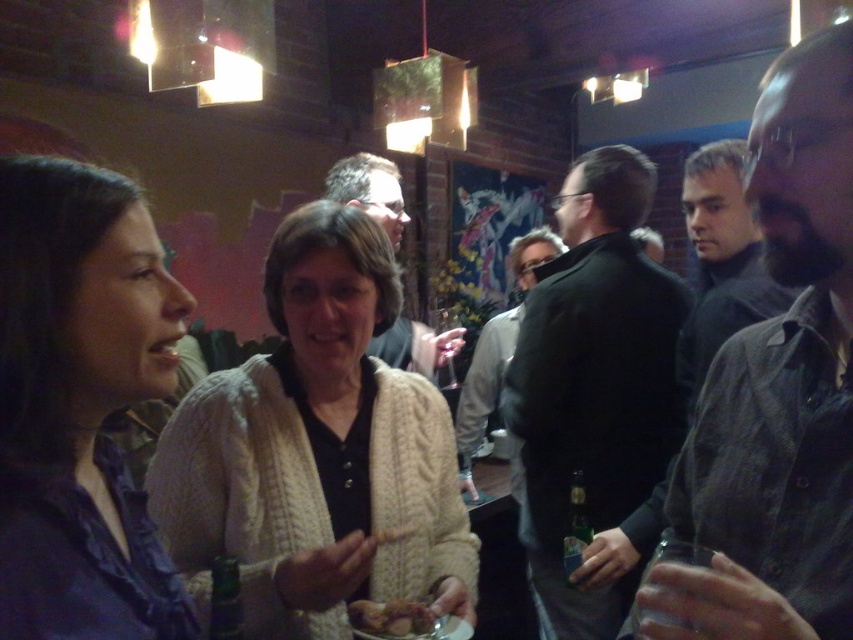
You are a photographer at the event and want to capture a photo of the creamy knit sweater at center and black matte jacket at center. Which one is positioned higher on the person?

The creamy knit sweater at center is located above the black matte jacket at center, so the sweater is positioned higher on the person.

You are a bartender preparing to serve drinks. You have a new customer who is wearing a matte blue shirt at left and another customer holding a clear plastic wine glass at center. Which customer requires a larger drink container based on their clothing size?

The matte blue shirt at left is larger in width than the clear plastic wine glass at center, so the customer wearing the matte blue shirt at left would require a larger drink container based on their clothing size.